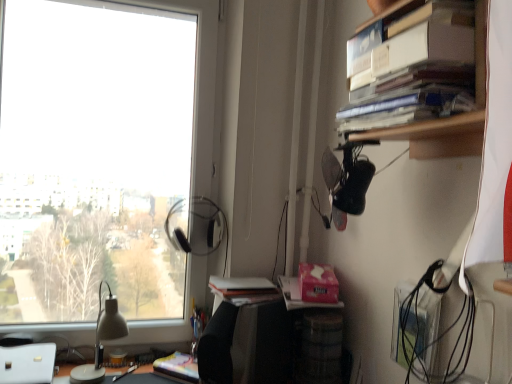
Question: From the image's perspective, is multicolored paper at lower center above or below matte white lamp at left?

Choices:
 (A) below
 (B) above

Answer: (A)

Question: Visually, is multicolored paper at lower center positioned to the left or to the right of matte white lamp at left?

Choices:
 (A) right
 (B) left

Answer: (A)

Question: Estimate the real-world distances between objects in this image. Which object is closer to the white matte book at center?

Choices:
 (A) matte white lamp at left
 (B) matte black desk at lower center
 (C) transparent glass window at upper left
 (D) multicolored paper at lower center
 (E) hardcover books at upper right

Answer: (D)

Question: Which object is the closest to the matte white lamp at left?

Choices:
 (A) matte black desk at lower center
 (B) multicolored paper at lower center
 (C) white matte book at center
 (D) transparent glass window at upper left
 (E) hardcover books at upper right

Answer: (A)